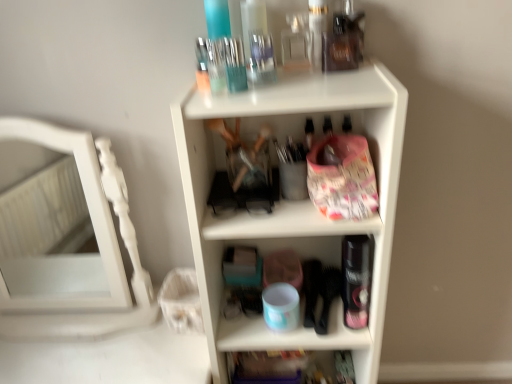
Question: Is there a large distance between white plastic shelf at center, which is counted as the second shelf, starting from the bottom, and translucent plastic container at lower center, positioned as the 1th shelf in bottom-to-top order?

Choices:
 (A) yes
 (B) no

Answer: (B)

Question: Considering the relative sizes of white plastic shelf at center, the first shelf from the top, and translucent plastic container at lower center, the second shelf when ordered from top to bottom, in the image provided, is white plastic shelf at center, the first shelf from the top, wider than translucent plastic container at lower center, the second shelf when ordered from top to bottom,?

Choices:
 (A) yes
 (B) no

Answer: (A)

Question: Is white plastic shelf at center, which is counted as the second shelf, starting from the bottom, facing towards translucent plastic container at lower center, positioned as the 1th shelf in bottom-to-top order?

Choices:
 (A) no
 (B) yes

Answer: (B)

Question: Is translucent plastic container at lower center, the second shelf when ordered from top to bottom, a part of white plastic shelf at center, the first shelf from the top?

Choices:
 (A) yes
 (B) no

Answer: (A)

Question: From a real-world perspective, is white plastic shelf at center, which is counted as the second shelf, starting from the bottom, physically below translucent plastic container at lower center, positioned as the 1th shelf in bottom-to-top order?

Choices:
 (A) no
 (B) yes

Answer: (A)

Question: Can we say white plastic shelf at center, the first shelf from the top, lies outside translucent plastic container at lower center, the second shelf when ordered from top to bottom?

Choices:
 (A) no
 (B) yes

Answer: (B)

Question: Would you consider translucent plastic container at lower center, positioned as the 1th shelf in bottom-to-top order, to be distant from white wooden mirror at left?

Choices:
 (A) no
 (B) yes

Answer: (A)

Question: Considering the relative sizes of translucent plastic container at lower center, positioned as the 1th shelf in bottom-to-top order, and white wooden mirror at left in the image provided, is translucent plastic container at lower center, positioned as the 1th shelf in bottom-to-top order, bigger than white wooden mirror at left?

Choices:
 (A) no
 (B) yes

Answer: (A)

Question: Can you confirm if translucent plastic container at lower center, positioned as the 1th shelf in bottom-to-top order, is wider than white wooden mirror at left?

Choices:
 (A) no
 (B) yes

Answer: (A)

Question: Is translucent plastic container at lower center, the second shelf when ordered from top to bottom, with white wooden mirror at left?

Choices:
 (A) no
 (B) yes

Answer: (A)

Question: From the image's perspective, would you say translucent plastic container at lower center, the second shelf when ordered from top to bottom, is shown under white wooden mirror at left?

Choices:
 (A) no
 (B) yes

Answer: (B)

Question: Is translucent plastic container at lower center, positioned as the 1th shelf in bottom-to-top order, not within white wooden mirror at left?

Choices:
 (A) no
 (B) yes

Answer: (B)

Question: From the image's perspective, is translucent plastic container at lower center, the second shelf when ordered from top to bottom, above white plastic shelf at center, the first shelf from the top?

Choices:
 (A) yes
 (B) no

Answer: (B)